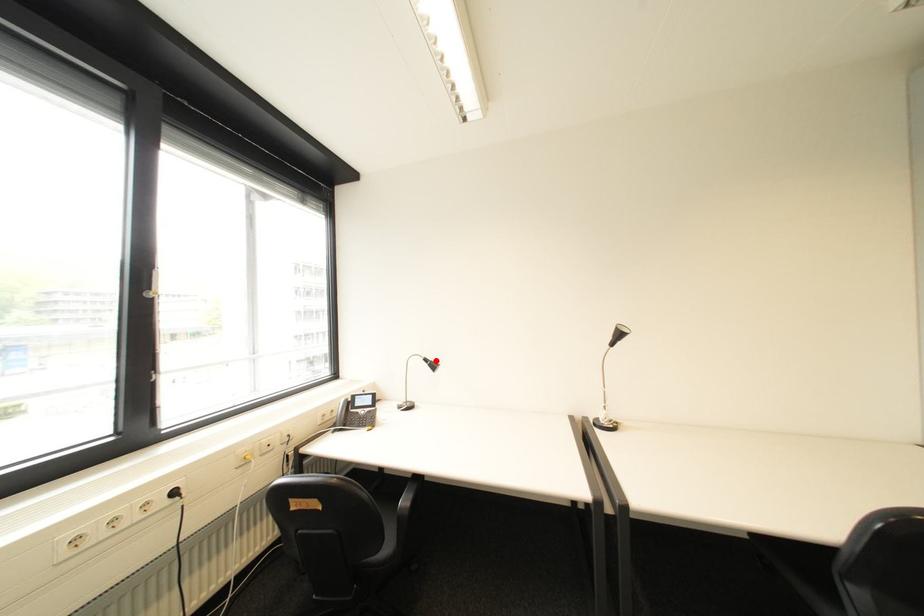
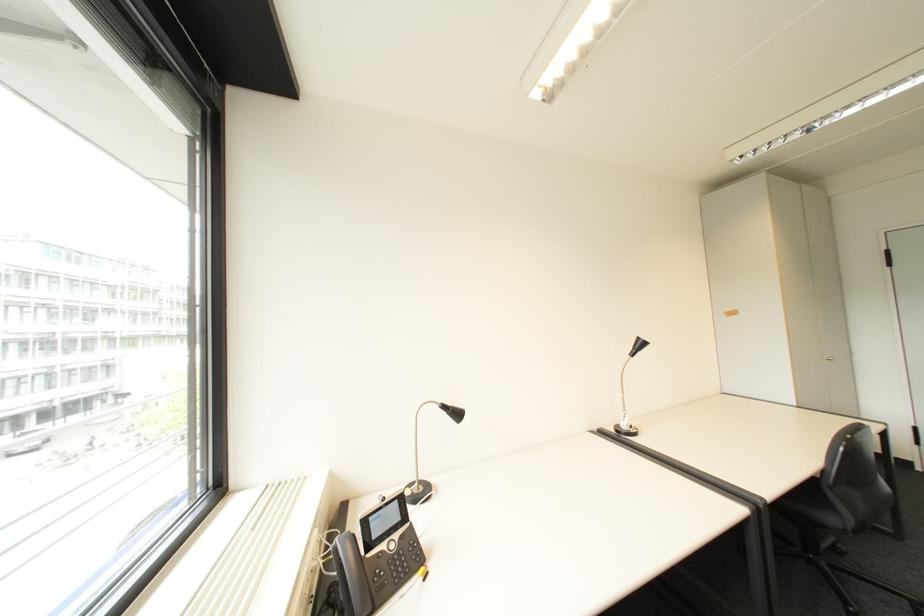
Find the pixel in the second image that matches the highlighted location in the first image.

(455, 407)